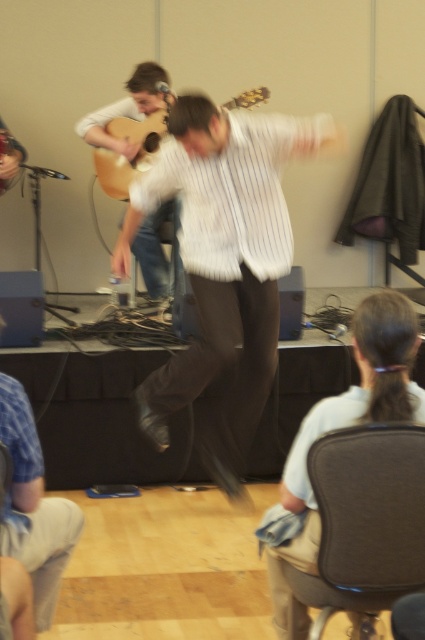
Question: Based on their relative distances, which object is farther from the white striped shirt at center?

Choices:
 (A) blue denim shorts at lower left
 (B) black fabric chair at lower right

Answer: (B)

Question: Is black fabric chair at lower right bigger than acoustic wood guitar at center?

Choices:
 (A) no
 (B) yes

Answer: (A)

Question: Can you confirm if blue denim shorts at lower left is thinner than acoustic wood guitar at center?

Choices:
 (A) no
 (B) yes

Answer: (B)

Question: Which point is farther to the camera?

Choices:
 (A) blue denim shorts at lower left
 (B) acoustic wood guitar at center

Answer: (B)

Question: Based on their relative distances, which object is nearer to the black fabric chair at lower right?

Choices:
 (A) blue denim shorts at lower left
 (B) white striped shirt at center
 (C) acoustic wood guitar at center

Answer: (A)

Question: In this image, where is blue denim shorts at lower left located relative to acoustic wood guitar at center?

Choices:
 (A) below
 (B) above

Answer: (A)